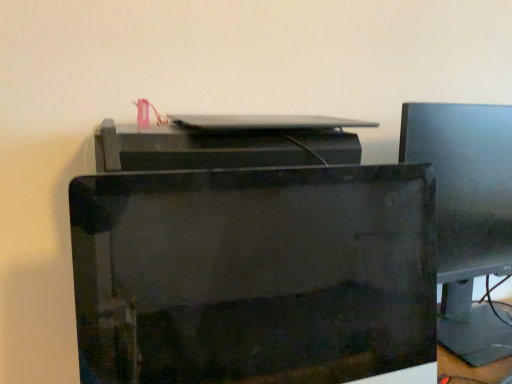
Question: From the image's perspective, is glossy black printer at center on satin silver laptop at center?

Choices:
 (A) yes
 (B) no

Answer: (B)

Question: Is glossy black printer at center beside satin silver laptop at center?

Choices:
 (A) yes
 (B) no

Answer: (B)

Question: Can you confirm if glossy black printer at center is shorter than satin silver laptop at center?

Choices:
 (A) no
 (B) yes

Answer: (A)

Question: From a real-world perspective, is glossy black printer at center over satin silver laptop at center?

Choices:
 (A) no
 (B) yes

Answer: (A)

Question: Does glossy black printer at center lie in front of satin silver laptop at center?

Choices:
 (A) no
 (B) yes

Answer: (B)

Question: Is glossy black printer at center positioned with its back to satin silver laptop at center?

Choices:
 (A) yes
 (B) no

Answer: (A)

Question: Is satin silver laptop at center taller than matte black monitor at right?

Choices:
 (A) no
 (B) yes

Answer: (A)

Question: Is matte black monitor at right at the back of satin silver laptop at center?

Choices:
 (A) yes
 (B) no

Answer: (B)

Question: Considering the relative sizes of satin silver laptop at center and matte black monitor at right in the image provided, is satin silver laptop at center shorter than matte black monitor at right?

Choices:
 (A) no
 (B) yes

Answer: (B)

Question: Is satin silver laptop at center at the right side of matte black monitor at right?

Choices:
 (A) yes
 (B) no

Answer: (B)

Question: Is matte black monitor at right inside satin silver laptop at center?

Choices:
 (A) no
 (B) yes

Answer: (A)

Question: Would you say satin silver laptop at center is a long distance from matte black monitor at right?

Choices:
 (A) no
 (B) yes

Answer: (A)

Question: Does matte black monitor at right lie behind glossy black printer at center?

Choices:
 (A) no
 (B) yes

Answer: (B)